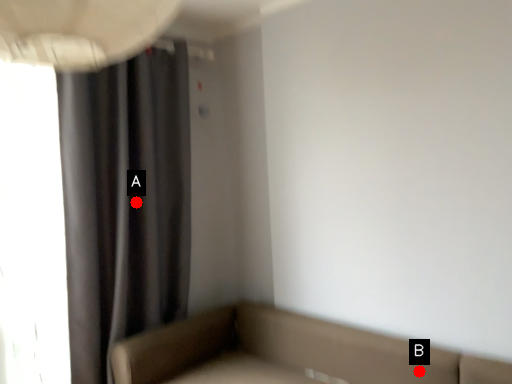
Question: Two points are circled on the image, labeled by A and B beside each circle. Which of the following is the farthest from the observer?

Choices:
 (A) A is further
 (B) B is further

Answer: (A)